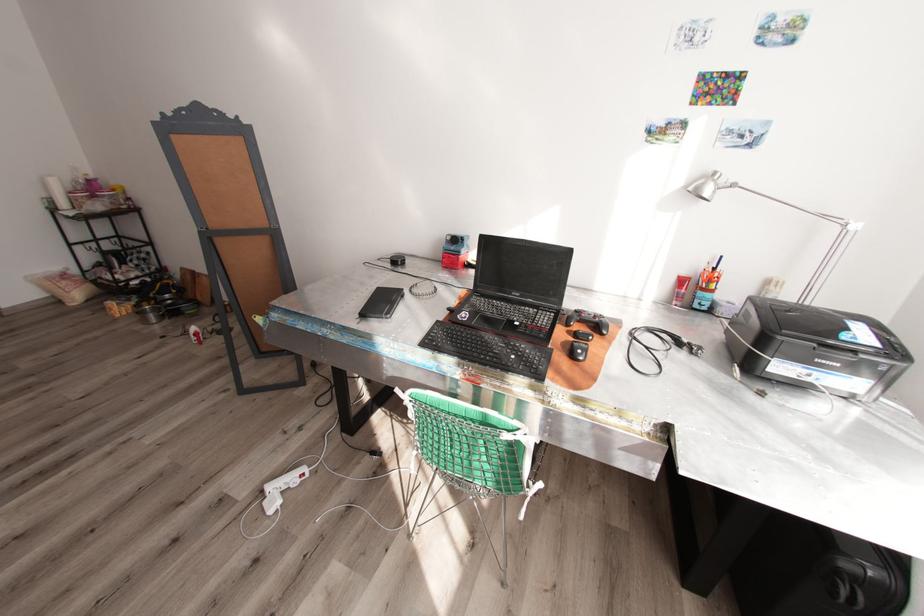
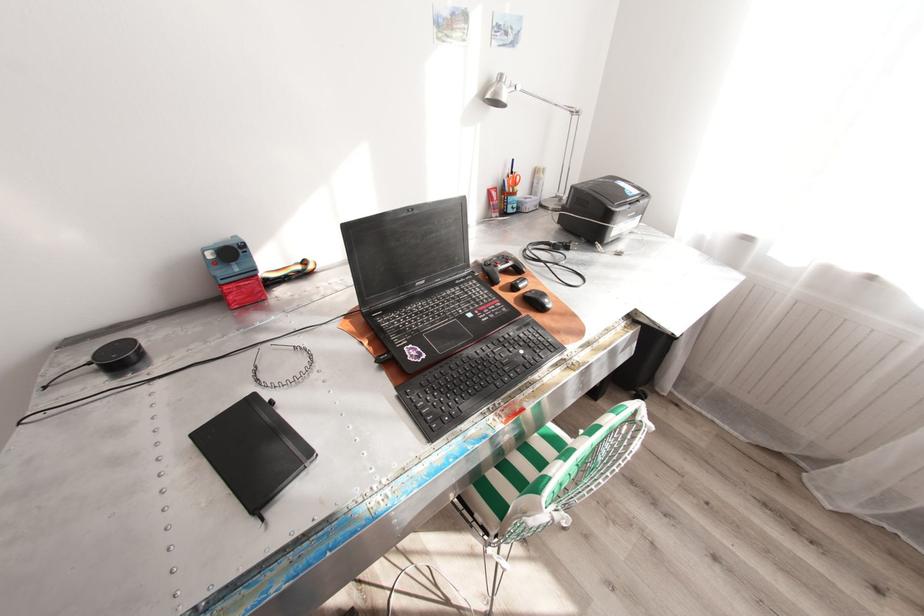
Locate, in the second image, the point that corresponds to [719,172] in the first image.

(505, 76)